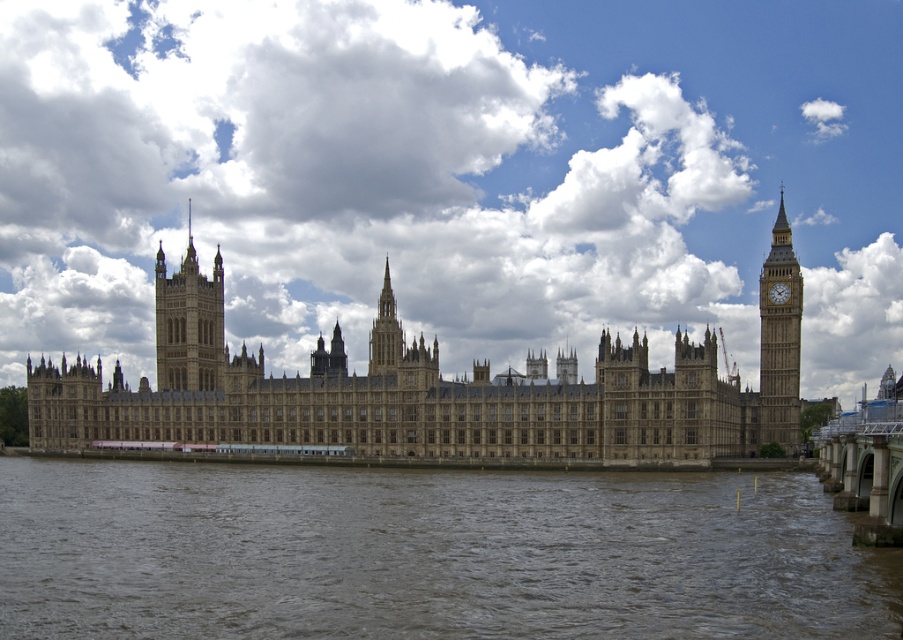
Based on the photo, you are a tourist standing at the Westminster Bridge and want to take a photo of the Palace of Westminster. In your viewfinder, you see the brown water at lower left and the gold metallic clock at upper right. Which object in your viewfinder is wider?

The brown water at lower left is wider than the gold metallic clock at upper right according to the description.

You are standing at the Westminster Bridge and want to know how far the point at coordinates point [552,436] is from you. Can you determine the distance?

The point at coordinates point [552,436] is 106.38 meters away from you.

You are standing at the center of the Palace of Westminster and want to find the brown water at lower left. According to the coordinates provided, where should you look relative to your position?

The brown water at lower left is located at point coordinates, so you should look to the lower left from your position at the center.